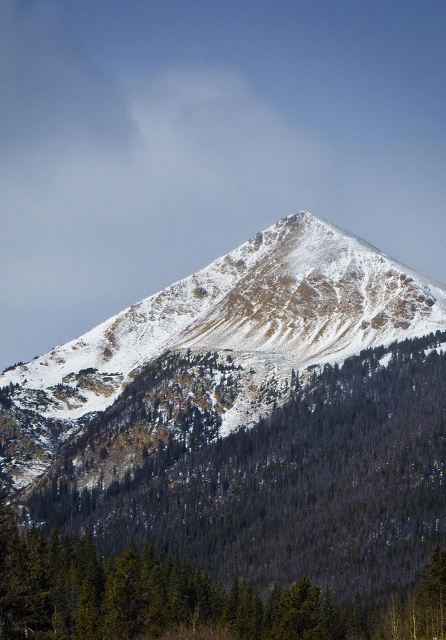
You are a hiker planning to take a photo of the snowy rocky peak at center from the base of the mountain. There is a green textured tree at center in your way. Will the tree block your view of the peak?

The green textured tree at center is in front of the snowy rocky peak at center, so it will block your view of the peak.

You are planning to take a photo of the snowy rocky peak at center and the green textured tree at center. Which object will appear wider in the photo?

The snowy rocky peak at center will appear wider in the photo because the green textured tree at center has a lesser width compared to it.

You are a hiker planning to climb the snowy rocky peak at center. From your current position at the base of the green textured tree at center, which object will you see first as you ascend the mountain?

As you ascend the mountain, the green textured tree at center will be visible first since it is shorter than the snowy rocky peak at center, meaning the peak will come into view after the tree.